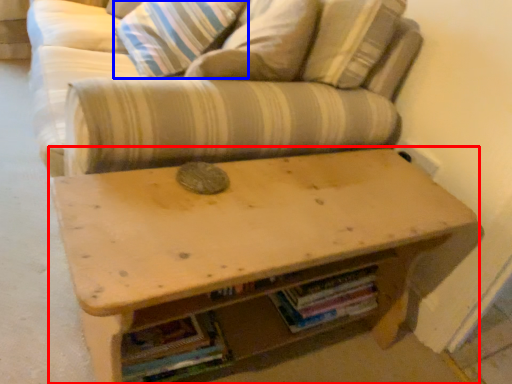
Question: Which point is further to the camera, table (highlighted by a red box) or pillow (highlighted by a blue box)?

Choices:
 (A) table
 (B) pillow

Answer: (B)